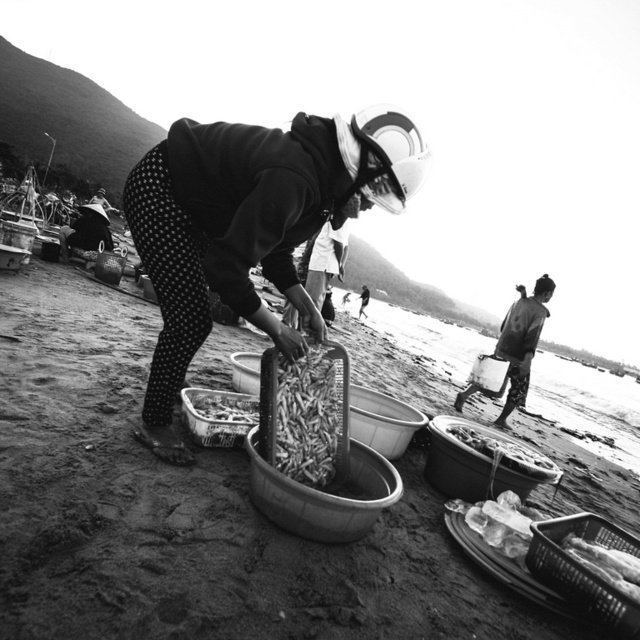
You are a photographer trying to capture the scene from above. You want to ensure both the smooth plastic basket at lower right and the shiny metallic tray at center are visible in your shot. Based on their positions, which object will appear lower in the photo?

The smooth plastic basket at lower right is located below the shiny metallic tray at center, so it will appear lower in the photo.

You are standing at the center of the beach scene and want to place a new object at the same location as the rustic woven basket at lower right. What coordinates should you use?

You should use the coordinates point (584, 570) to place the new object at the same location as the rustic woven basket at lower right.

You are a photographer trying to capture the rustic woven basket at lower right and the translucent plastic basket at lower right in the same frame. Based on their positions, which basket should you adjust your camera angle to include first?

The translucent plastic basket at lower right should be adjusted first since the rustic woven basket at lower right is positioned to its right, meaning it is further to the right and might be out of frame if not properly angled.